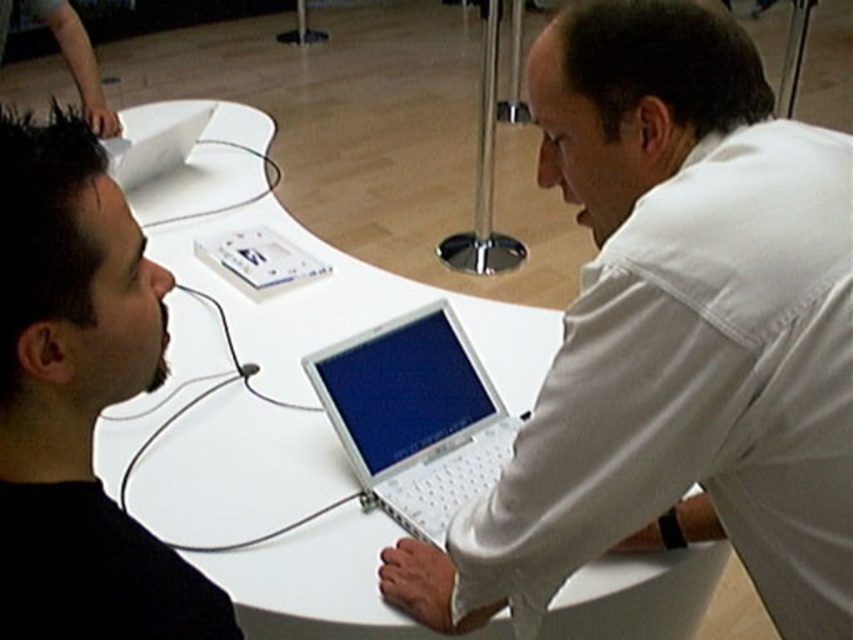
Question: Is white matte laptop at center positioned in front of white glossy table at center?

Choices:
 (A) no
 (B) yes

Answer: (B)

Question: Is white glossy table at center to the right of black matte laptop at left from the viewer's perspective?

Choices:
 (A) no
 (B) yes

Answer: (A)

Question: Among these points, which one is nearest to the camera?

Choices:
 (A) (683, 637)
 (B) (126, 189)
 (C) (428, 452)

Answer: (C)

Question: Which object appears closest to the camera in this image?

Choices:
 (A) silver metallic laptop at center
 (B) white glossy table at center
 (C) white plastic laptop at upper left
 (D) black matte laptop at left

Answer: (D)

Question: Estimate the real-world distances between objects in this image. Which object is closer to the white matte laptop at center?

Choices:
 (A) black matte laptop at left
 (B) white plastic laptop at upper left
 (C) silver metallic laptop at center
 (D) white glossy table at center

Answer: (C)

Question: Is white glossy table at center above silver metallic laptop at center?

Choices:
 (A) no
 (B) yes

Answer: (B)